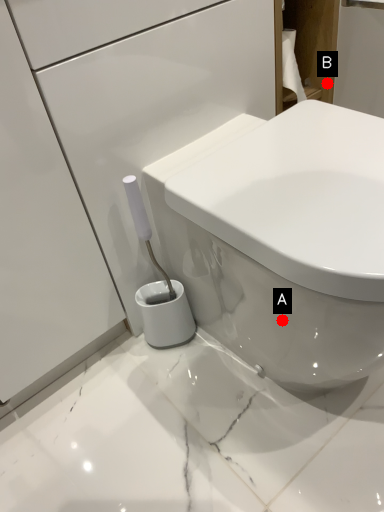
Question: Two points are circled on the image, labeled by A and B beside each circle. Which point is further to the camera?

Choices:
 (A) A is further
 (B) B is further

Answer: (B)